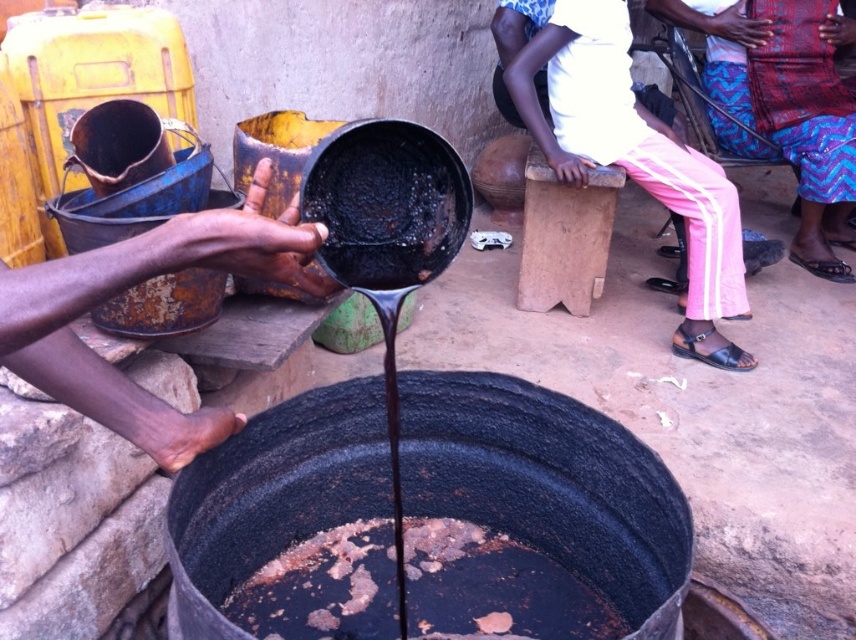
Does blue-patterned fabric at center have a greater width compared to black matte pot at center?

Indeed, blue-patterned fabric at center has a greater width compared to black matte pot at center.

Between point (712, 61) and point (342, 220), which one is positioned in front?

Point (342, 220)

Which is in front, point (746, 148) or point (452, 246)?

Positioned in front is point (452, 246).

Find the location of a particular element. This screenshot has height=640, width=856. blue-patterned fabric at center is located at coordinates point(789,106).

Who is more distant from viewer, (801,56) or (272,112)?

Point (801,56)

Does point (829, 225) come behind point (282, 128)?

Yes, point (829, 225) is farther from viewer.

This screenshot has width=856, height=640. What do you see at coordinates (789, 106) in the screenshot?
I see `blue-patterned fabric at center` at bounding box center [789, 106].

Image resolution: width=856 pixels, height=640 pixels. Identify the location of blue-patterned fabric at center. (789, 106).

Can you confirm if black matte pot at center is positioned below rusty metal pot at center?

Yes, black matte pot at center is below rusty metal pot at center.

Can you confirm if black matte pot at center is positioned above rusty metal pot at center?

Actually, black matte pot at center is below rusty metal pot at center.

The image size is (856, 640). Identify the location of black matte pot at center. (385, 204).